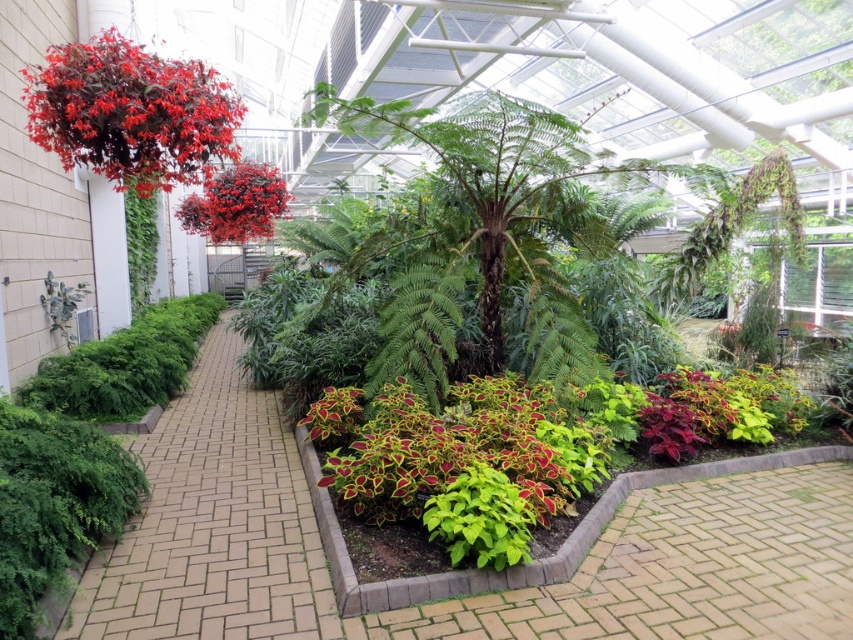
Measure the distance between green leafy tree at center and camera.

4.09 meters

Between green leafy tree at center and glossy red berries at upper center, which one is positioned higher?

Positioned higher is glossy red berries at upper center.

Which is in front, point (527, 333) or point (260, 236)?

Positioned in front is point (527, 333).

Identify the location of green leafy tree at center. (488, 234).

You are a GUI agent. You are given a task and a screenshot of the screen. Output one action in this format:
    pyautogui.click(x=<x>, y=<y>)
    Task: Click on the brown brick pathway at center
    
    Given the screenshot: What is the action you would take?
    pyautogui.click(x=213, y=524)

Based on the photo, is brown brick pathway at center taller than matte red hanging basket at upper left?

In fact, brown brick pathway at center may be shorter than matte red hanging basket at upper left.

Where is `brown brick pathway at center`? Image resolution: width=853 pixels, height=640 pixels. brown brick pathway at center is located at coordinates (213, 524).

I want to click on brown brick pathway at center, so click(213, 524).

Does point (271, 627) lie in front of point (230, 211)?

Yes.

Does brown brick pathway at center appear on the right side of glossy red berries at upper center?

Indeed, brown brick pathway at center is positioned on the right side of glossy red berries at upper center.

Is point (102, 630) farther from viewer compared to point (283, 195)?

No, (102, 630) is in front of (283, 195).

Locate an element on the screen. brown brick pathway at center is located at coordinates (213, 524).